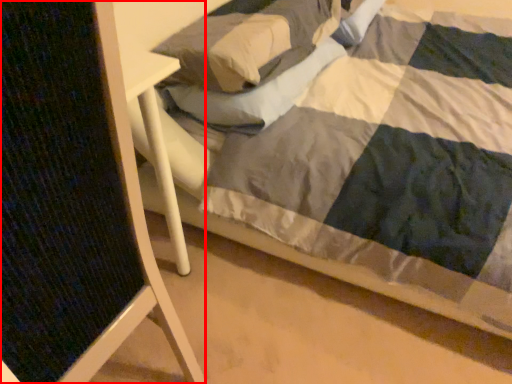
Question: From the image's perspective, where is folding chair (annotated by the red box) located in relation to pillow in the image?

Choices:
 (A) below
 (B) above

Answer: (A)